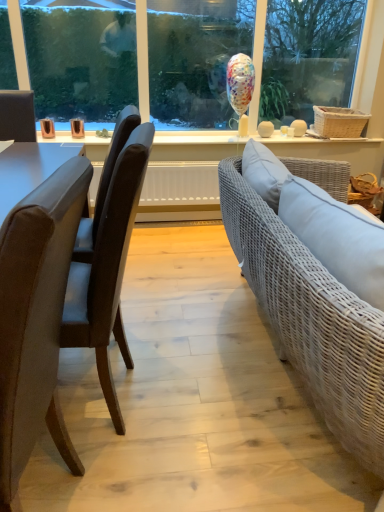
Find the location of a particular element. The image size is (384, 512). brown leather chair at left, which is the 1th chair from front to back is located at coordinates (36, 319).

What do you see at coordinates (36, 319) in the screenshot?
I see `brown leather chair at left, which is the 1th chair from front to back` at bounding box center [36, 319].

At what (x,y) coordinates should I click in order to perform the action: click on leather chair at left, the second chair from the front. Please return your answer as a coordinate pair (x, y). The width and height of the screenshot is (384, 512). Looking at the image, I should click on (108, 269).

What do you see at coordinates (108, 269) in the screenshot? I see `leather chair at left, the 1th chair from the back` at bounding box center [108, 269].

At what (x,y) coordinates should I click in order to perform the action: click on brown leather chair at left, which is the 1th chair from front to back. Please return your answer as a coordinate pair (x, y). This screenshot has height=512, width=384. Looking at the image, I should click on (36, 319).

Visually, is brown leather chair at left, positioned as the 2th chair in back-to-front order, positioned to the left or to the right of leather chair at left, the second chair from the front?

From the image, it's evident that brown leather chair at left, positioned as the 2th chair in back-to-front order, is to the right of leather chair at left, the second chair from the front.

Is brown leather chair at left, positioned as the 2th chair in back-to-front order, in front of or behind leather chair at left, the 1th chair from the back, in the image?

In the image, brown leather chair at left, positioned as the 2th chair in back-to-front order, appears in front of leather chair at left, the 1th chair from the back.

Which is behind, point (3, 449) or point (79, 344)?

The point (79, 344) is farther from the camera.

From the image's perspective, which is above, brown leather chair at left, which is the 1th chair from front to back, or leather chair at left, the second chair from the front?

From the image's view, leather chair at left, the second chair from the front, is above.

From a real-world perspective, is brown leather chair at left, positioned as the 2th chair in back-to-front order, positioned above or below leather chair at left, the second chair from the front?

Clearly, from a real-world perspective, brown leather chair at left, positioned as the 2th chair in back-to-front order, is above leather chair at left, the second chair from the front.

Considering the sizes of objects brown leather chair at left, which is the 1th chair from front to back, and leather chair at left, the 1th chair from the back, in the image provided, who is thinner, brown leather chair at left, which is the 1th chair from front to back, or leather chair at left, the 1th chair from the back,?

With smaller width is brown leather chair at left, which is the 1th chair from front to back.

Considering the relative sizes of brown leather chair at left, positioned as the 2th chair in back-to-front order, and leather chair at left, the second chair from the front, in the image provided, is brown leather chair at left, positioned as the 2th chair in back-to-front order, shorter than leather chair at left, the second chair from the front,?

Yes, brown leather chair at left, positioned as the 2th chair in back-to-front order, is shorter than leather chair at left, the second chair from the front.

Does brown leather chair at left, positioned as the 2th chair in back-to-front order, have a smaller size compared to leather chair at left, the second chair from the front?

Yes, brown leather chair at left, positioned as the 2th chair in back-to-front order, is smaller than leather chair at left, the second chair from the front.

Would you say brown leather chair at left, positioned as the 2th chair in back-to-front order, contains leather chair at left, the second chair from the front?

No, leather chair at left, the second chair from the front, is not inside brown leather chair at left, positioned as the 2th chair in back-to-front order.

Is brown leather chair at left, which is the 1th chair from front to back, far away from leather chair at left, the second chair from the front?

That's not correct — brown leather chair at left, which is the 1th chair from front to back, is a little close to leather chair at left, the second chair from the front.

Is brown leather chair at left, which is the 1th chair from front to back, oriented towards leather chair at left, the second chair from the front?

No, brown leather chair at left, which is the 1th chair from front to back, is not facing towards leather chair at left, the second chair from the front.

How many degrees apart are the facing directions of brown leather chair at left, which is the 1th chair from front to back, and leather chair at left, the second chair from the front?

5.25e-05 degrees separate the facing orientations of brown leather chair at left, which is the 1th chair from front to back, and leather chair at left, the second chair from the front.

Could you measure the distance between brown leather chair at left, positioned as the 2th chair in back-to-front order, and leather chair at left, the second chair from the front?

brown leather chair at left, positioned as the 2th chair in back-to-front order, and leather chair at left, the second chair from the front, are 11.86 inches apart from each other.

In the image, there is a brown leather chair at left, positioned as the 2th chair in back-to-front order. Where is `chair above it (from the image's perspective)`? The image size is (384, 512). chair above it (from the image's perspective) is located at coordinates pos(108,269).

Which is more to the left, leather chair at left, the 1th chair from the back, or brown leather chair at left, which is the 1th chair from front to back?

From the viewer's perspective, leather chair at left, the 1th chair from the back, appears more on the left side.

Who is more distant, leather chair at left, the second chair from the front, or brown leather chair at left, which is the 1th chair from front to back?

Positioned behind is leather chair at left, the second chair from the front.

Is point (116, 421) closer to viewer compared to point (18, 284)?

No, (116, 421) is further to viewer.

From the image's perspective, is leather chair at left, the second chair from the front, under brown leather chair at left, which is the 1th chair from front to back?

Actually, leather chair at left, the second chair from the front, appears above brown leather chair at left, which is the 1th chair from front to back, in the image.

From a real-world perspective, is leather chair at left, the second chair from the front, physically above brown leather chair at left, which is the 1th chair from front to back?

No, from a real-world perspective, leather chair at left, the second chair from the front, is not above brown leather chair at left, which is the 1th chair from front to back.

Which of these two, leather chair at left, the second chair from the front, or brown leather chair at left, which is the 1th chair from front to back, is wider?

leather chair at left, the second chair from the front, is wider.

Is leather chair at left, the 1th chair from the back, taller than brown leather chair at left, which is the 1th chair from front to back?

Yes.

Considering the sizes of objects leather chair at left, the 1th chair from the back, and brown leather chair at left, which is the 1th chair from front to back, in the image provided, who is bigger, leather chair at left, the 1th chair from the back, or brown leather chair at left, which is the 1th chair from front to back,?

Bigger between the two is leather chair at left, the 1th chair from the back.

Does leather chair at left, the second chair from the front, contain brown leather chair at left, positioned as the 2th chair in back-to-front order?

Actually, brown leather chair at left, positioned as the 2th chair in back-to-front order, is outside leather chair at left, the second chair from the front.

Would you consider leather chair at left, the 1th chair from the back, to be distant from brown leather chair at left, which is the 1th chair from front to back?

leather chair at left, the 1th chair from the back, is actually quite close to brown leather chair at left, which is the 1th chair from front to back.

Is leather chair at left, the 1th chair from the back, positioned with its back to brown leather chair at left, positioned as the 2th chair in back-to-front order?

leather chair at left, the 1th chair from the back, is not turned away from brown leather chair at left, positioned as the 2th chair in back-to-front order.

Consider the image. What's the angular difference between leather chair at left, the 1th chair from the back, and brown leather chair at left, positioned as the 2th chair in back-to-front order,'s facing directions?

5.25e-05 degrees separate the facing orientations of leather chair at left, the 1th chair from the back, and brown leather chair at left, positioned as the 2th chair in back-to-front order.

At what (x,y) coordinates should I click in order to perform the action: click on chair on the right side of leather chair at left, the second chair from the front. Please return your answer as a coordinate pair (x, y). The height and width of the screenshot is (512, 384). Looking at the image, I should click on (36, 319).

Locate an element on the screen. The height and width of the screenshot is (512, 384). chair that appears below the brown leather chair at left, positioned as the 2th chair in back-to-front order (from a real-world perspective) is located at coordinates click(x=108, y=269).

At what (x,y) coordinates should I click in order to perform the action: click on chair behind the brown leather chair at left, which is the 1th chair from front to back. Please return your answer as a coordinate pair (x, y). This screenshot has width=384, height=512. Looking at the image, I should click on (108, 269).